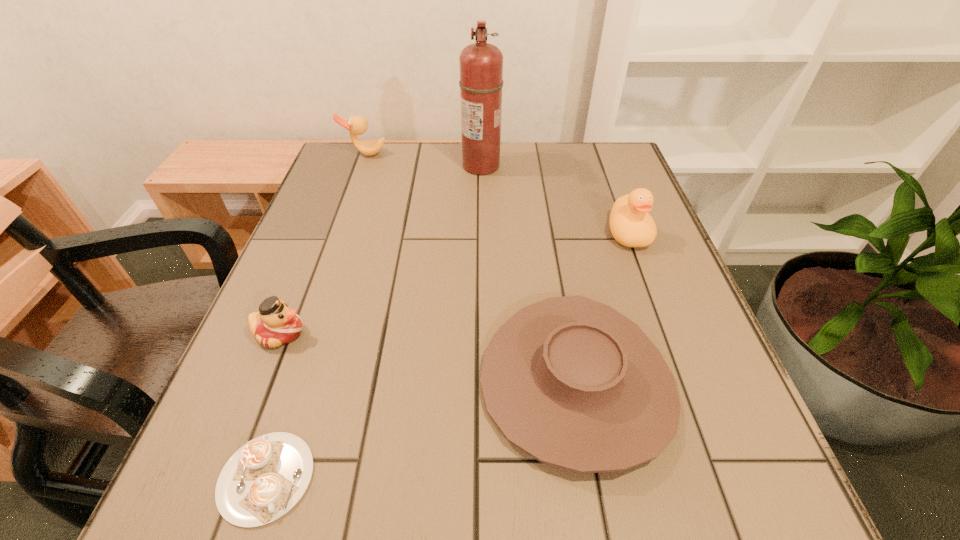
The width and height of the screenshot is (960, 540). I want to click on vacant space at the near right corner of the desktop, so click(x=799, y=530).

Find the location of a particular element. Image resolution: width=960 pixels, height=540 pixels. vacant space that is in between the tallest object and the shortest duck is located at coordinates (380, 249).

Locate an element on the screen. empty space between the nearest duck and the shortest object is located at coordinates (273, 405).

Identify the location of unoccupied position between the tallest object and the cowboy hat. (529, 275).

Identify the location of free space between the shortest object and the tallest object. This screenshot has width=960, height=540. (373, 322).

Image resolution: width=960 pixels, height=540 pixels. In order to click on unoccupied position between the cappuccino and the cowboy hat in this screenshot , I will do `click(421, 430)`.

Locate an element on the screen. The width and height of the screenshot is (960, 540). free point between the farthest duck and the shortest duck is located at coordinates (323, 244).

Find the location of `free space between the fire extinguisher and the cowboy hat`. free space between the fire extinguisher and the cowboy hat is located at coordinates (529, 275).

I want to click on object that stands as the fifth closest to the cowboy hat, so click(x=357, y=125).

You are a GUI agent. You are given a task and a screenshot of the screen. Output one action in this format:
    pyautogui.click(x=<x>, y=<y>)
    Task: Click on the object that is the fifth closest to the shortest duck
    This screenshot has width=960, height=540.
    Given the screenshot: What is the action you would take?
    pyautogui.click(x=631, y=225)